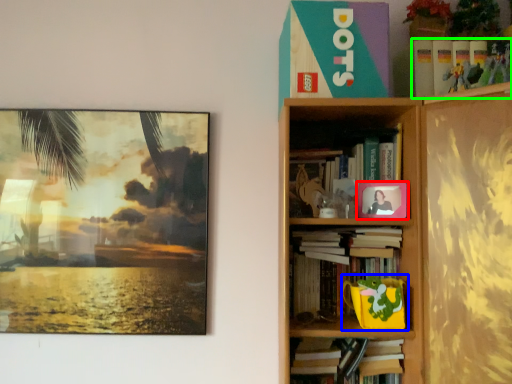
Question: Which object is the closest to the picture frame (highlighted by a red box)? Choose among these: toy (highlighted by a blue box) or book (highlighted by a green box).

Choices:
 (A) toy
 (B) book

Answer: (A)